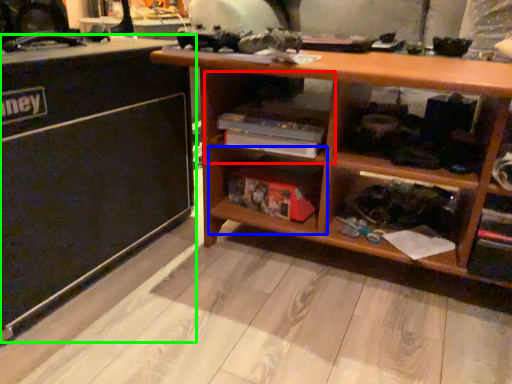
Question: Which object is the farthest from cabinet (highlighted by a red box)? Choose among these: shelf (highlighted by a blue box) or table (highlighted by a green box).

Choices:
 (A) shelf
 (B) table

Answer: (B)